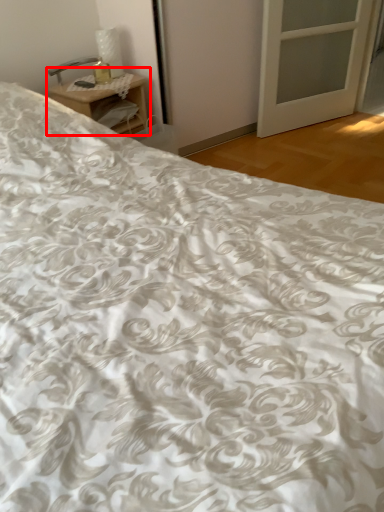
Question: From the image's perspective, where is nightstand (annotated by the red box) located relative to table lamp?

Choices:
 (A) below
 (B) above

Answer: (A)